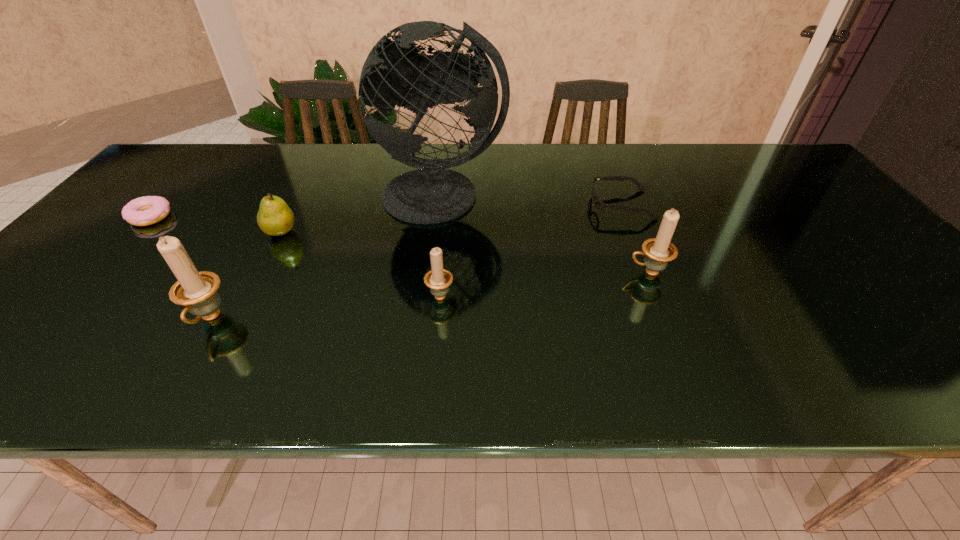
Find the location of `the leftmost candle_holder`. the leftmost candle_holder is located at coordinates (197, 291).

Where is `the tallest candle_holder`? Image resolution: width=960 pixels, height=540 pixels. the tallest candle_holder is located at coordinates (197, 291).

Locate an element on the screen. the second candle_holder from left to right is located at coordinates (438, 279).

This screenshot has width=960, height=540. I want to click on the rightmost candle_holder, so click(x=658, y=251).

This screenshot has height=540, width=960. In order to click on the fifth shortest object in this screenshot , I will do `click(658, 251)`.

I want to click on the leftmost object, so click(147, 210).

This screenshot has width=960, height=540. What are the coordinates of `the shortest object` in the screenshot? It's located at tap(147, 210).

I want to click on the tallest object, so click(394, 73).

Identify the location of pear. click(275, 218).

I want to click on spectacles, so click(598, 204).